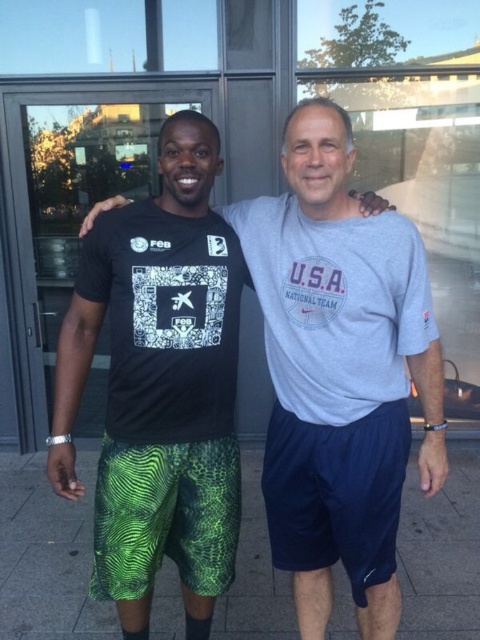
You are a photographer trying to capture a closeup of the green fabric shorts at lower center and the navy blue fabric shorts at center. Since you want to focus on both, which direction should you move your camera to ensure both are in frame?

The green fabric shorts at lower center is positioned on the left side of navy blue fabric shorts at center, so you should move your camera to the left to include both in the frame.

You are taking a photo of two people standing in front of a modern building. You notice two points in the image at coordinates point (44, 628) and point (319, 508). Which point is closer to the camera?

Point (44, 628) is further to the camera than point (319, 508), so the point closer to the camera is point (319, 508).